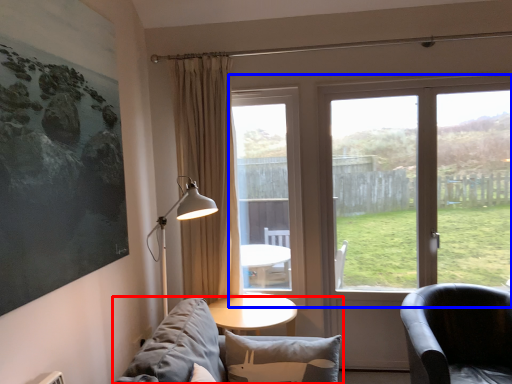
Question: Which object appears farthest to the camera in this image, studio couch (highlighted by a red box) or window (highlighted by a blue box)?

Choices:
 (A) studio couch
 (B) window

Answer: (B)